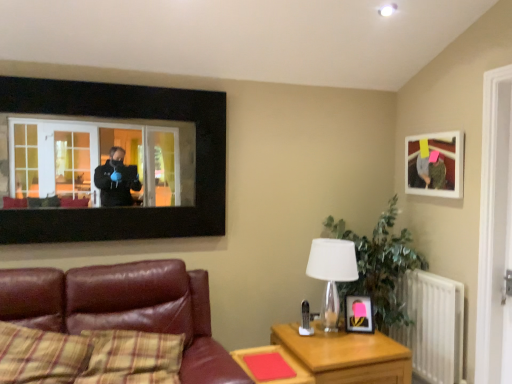
Question: Are leather couch at lower left and matte black picture frame at center, marked as the 2th picture frame in a right-to-left arrangement, beside each other?

Choices:
 (A) yes
 (B) no

Answer: (B)

Question: Does leather couch at lower left come behind matte black picture frame at center, marked as the 2th picture frame in a right-to-left arrangement?

Choices:
 (A) no
 (B) yes

Answer: (A)

Question: Can you confirm if leather couch at lower left is positioned to the right of matte black picture frame at center, the first picture frame from the bottom?

Choices:
 (A) yes
 (B) no

Answer: (B)

Question: From the image's perspective, would you say leather couch at lower left is positioned over matte black picture frame at center, the first picture frame from the bottom?

Choices:
 (A) no
 (B) yes

Answer: (A)

Question: Considering the relative sizes of leather couch at lower left and matte black picture frame at center, the first picture frame viewed from the left, in the image provided, is leather couch at lower left wider than matte black picture frame at center, the first picture frame viewed from the left,?

Choices:
 (A) yes
 (B) no

Answer: (A)

Question: From a real-world perspective, does leather couch at lower left stand above matte black picture frame at center, which appears as the 2th picture frame when viewed from the top?

Choices:
 (A) no
 (B) yes

Answer: (A)

Question: From the image's perspective, is leather couch at lower left on matte white picture frame at upper right, which is the second picture frame from left to right?

Choices:
 (A) yes
 (B) no

Answer: (B)

Question: From a real-world perspective, is leather couch at lower left on matte white picture frame at upper right, marked as the 1th picture frame in a top-to-bottom arrangement?

Choices:
 (A) yes
 (B) no

Answer: (B)

Question: Is leather couch at lower left in front of matte white picture frame at upper right, which ranks as the 1th picture frame in right-to-left order?

Choices:
 (A) yes
 (B) no

Answer: (A)

Question: Is the position of leather couch at lower left more distant than that of matte white picture frame at upper right, acting as the second picture frame starting from the bottom?

Choices:
 (A) no
 (B) yes

Answer: (A)

Question: Considering the relative positions of leather couch at lower left and matte white picture frame at upper right, acting as the second picture frame starting from the bottom, in the image provided, is leather couch at lower left to the right of matte white picture frame at upper right, acting as the second picture frame starting from the bottom, from the viewer's perspective?

Choices:
 (A) yes
 (B) no

Answer: (B)

Question: From the image's perspective, is leather couch at lower left under matte white picture frame at upper right, which is the second picture frame from left to right?

Choices:
 (A) no
 (B) yes

Answer: (B)

Question: From the image's perspective, is black matte window frame at upper left located beneath white metallic radiator at right?

Choices:
 (A) yes
 (B) no

Answer: (B)